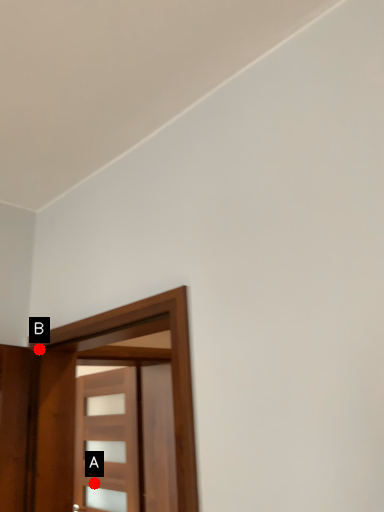
Question: Two points are circled on the image, labeled by A and B beside each circle. Among these points, which one is nearest to the camera?

Choices:
 (A) A is closer
 (B) B is closer

Answer: (B)